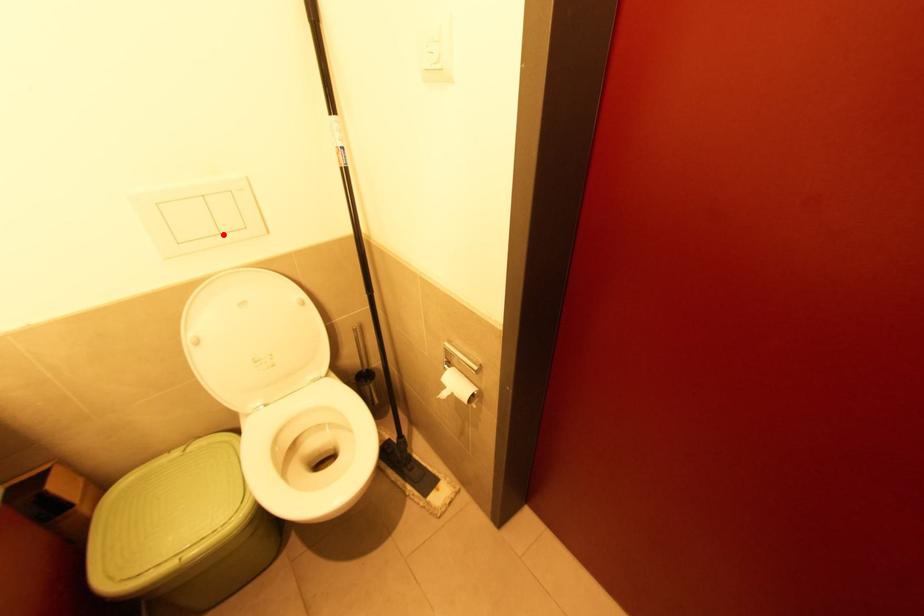
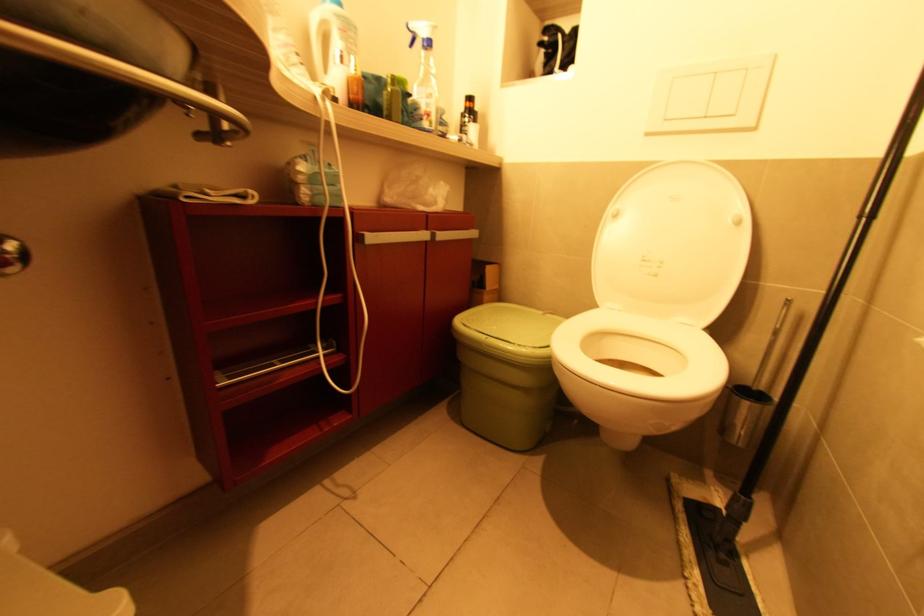
Find the pixel in the second image that matches the highlighted location in the first image.

(709, 118)